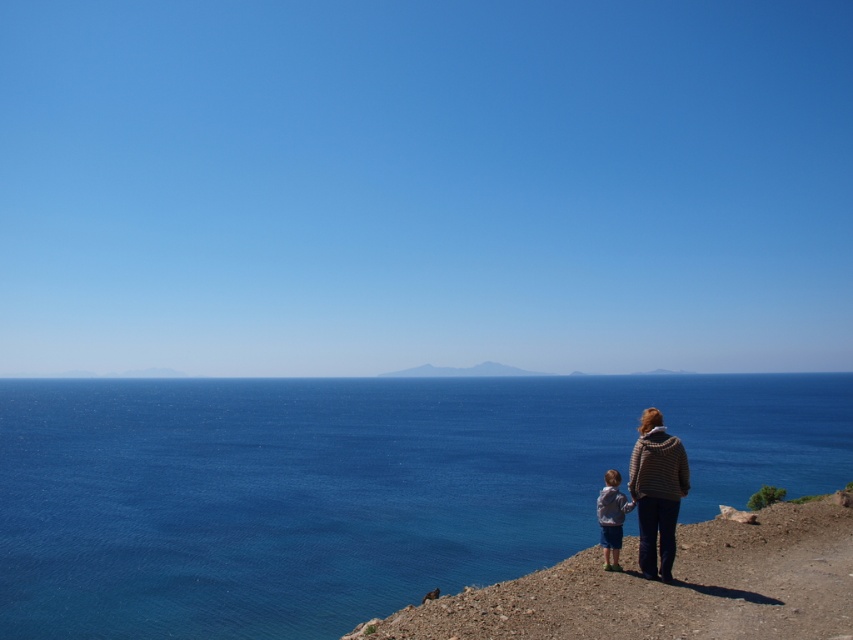
You are a photographer trying to capture a family photo at the coast. You see the blue water at lower left and the light gray fleece jacket at lower right. Which object is closer to the right edge of the photo?

The light gray fleece jacket at lower right is closer to the right edge of the photo because the blue water at lower left is positioned on its left side.

You are a photographer trying to capture a photo of the blue water at lower left and the light gray fleece jacket at lower right. Based on their positions, which object is closer to the camera?

The blue water at lower left is closer to the camera because the light gray fleece jacket at lower right is behind it.